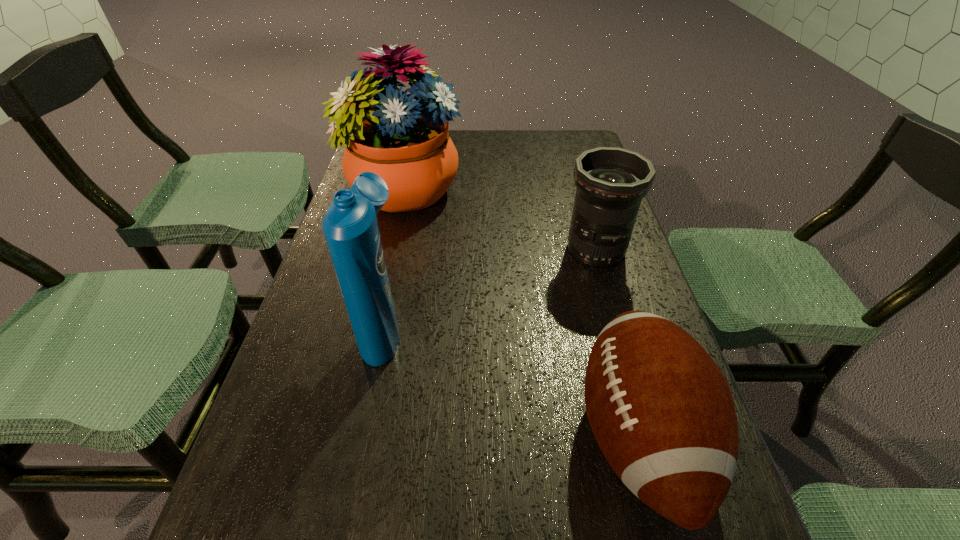
The width and height of the screenshot is (960, 540). I want to click on flower arrangement, so click(x=405, y=142).

At what (x,y) coordinates should I click in order to perform the action: click on the third shortest object. Please return your answer as a coordinate pair (x, y). This screenshot has height=540, width=960. Looking at the image, I should click on (350, 227).

You are a GUI agent. You are given a task and a screenshot of the screen. Output one action in this format:
    pyautogui.click(x=<x>, y=<y>)
    Task: Click on the second farthest object
    The width and height of the screenshot is (960, 540).
    Given the screenshot: What is the action you would take?
    pyautogui.click(x=611, y=182)

Where is `vacant space situated on the right of the flower arrangement`? The width and height of the screenshot is (960, 540). vacant space situated on the right of the flower arrangement is located at coordinates (489, 191).

At what (x,y) coordinates should I click in order to perform the action: click on vacant space situated 0.290m on the back of the shampoo. Please return your answer as a coordinate pair (x, y). The width and height of the screenshot is (960, 540). Looking at the image, I should click on (406, 215).

Where is `free region located on the front of the telephoto lens`? The width and height of the screenshot is (960, 540). free region located on the front of the telephoto lens is located at coordinates tap(607, 288).

Identify the location of object that is positioned at the far edge. (405, 142).

At what (x,y) coordinates should I click in order to perform the action: click on flower arrangement that is at the left edge. Please return your answer as a coordinate pair (x, y). The image size is (960, 540). Looking at the image, I should click on (405, 142).

Find the location of `shampoo that is at the left edge`. shampoo that is at the left edge is located at coordinates (350, 227).

Locate an element on the screen. object that is at the right edge is located at coordinates (611, 182).